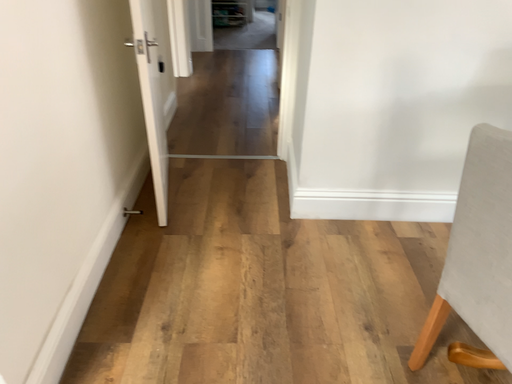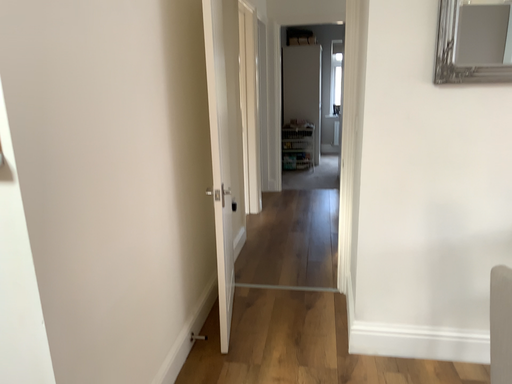
Question: Which way did the camera rotate in the video?

Choices:
 (A) rotated upward
 (B) rotated downward

Answer: (A)